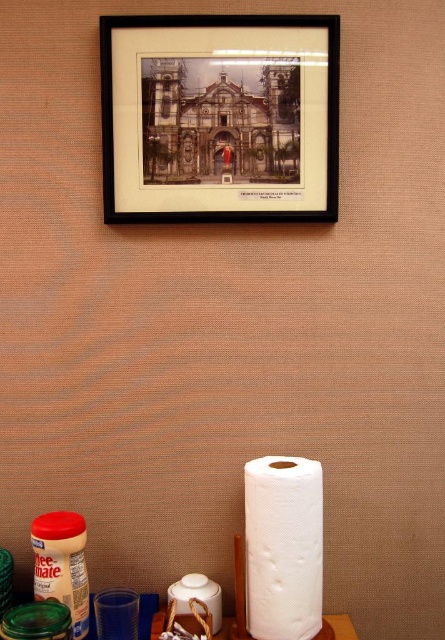
Between black matte picture frame at upper center and white matte toilet paper at lower center, which one has less height?

With less height is white matte toilet paper at lower center.

Does point (199, 83) come closer to viewer compared to point (291, 513)?

No.

I want to click on black matte picture frame at upper center, so click(x=219, y=116).